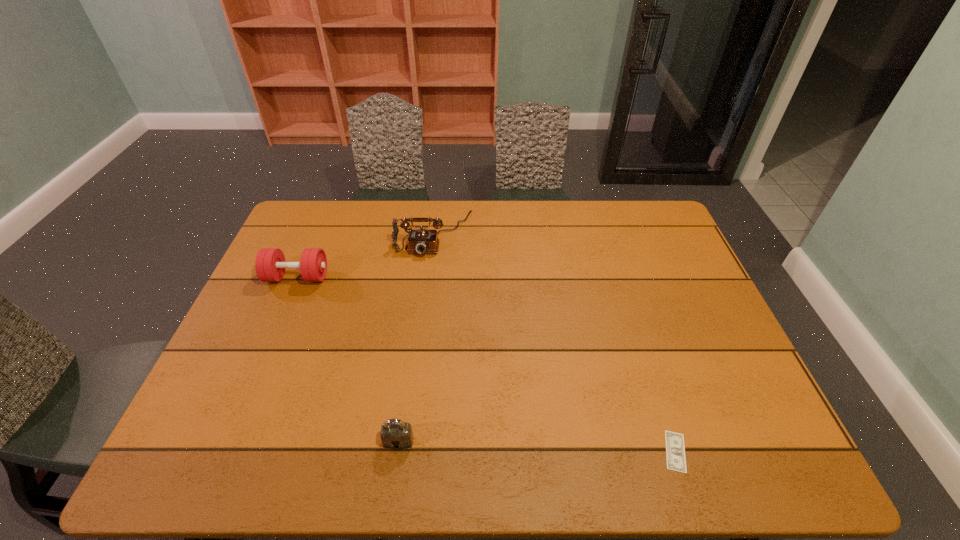
At what (x,y) coordinates should I click in order to perform the action: click on the closest object to the dumbbell. Please return your answer as a coordinate pair (x, y). This screenshot has width=960, height=540. Looking at the image, I should click on (421, 241).

Identify which object is located as the nearest to the padlock. Please provide its 2D coordinates. Your answer should be formatted as a tuple, i.e. [(x, y)], where the tuple contains the x and y coordinates of a point satisfying the conditions above.

[(270, 265)]

At what (x,y) coordinates should I click in order to perform the action: click on free space in the image that satisfies the following two spatial constraints: 1. on the dial of the telephone; 2. on the left side of the shortest object. Please return your answer as a coordinate pair (x, y). The width and height of the screenshot is (960, 540). Looking at the image, I should click on (407, 451).

Find the location of `free location that satisfies the following two spatial constraints: 1. on the front side of the rightmost object; 2. on the right side of the dumbbell`. free location that satisfies the following two spatial constraints: 1. on the front side of the rightmost object; 2. on the right side of the dumbbell is located at coordinates (223, 451).

In order to click on free space that satisfies the following two spatial constraints: 1. at the front of the shortest object near the keyhole; 2. on the right side of the padlock in this screenshot , I will do `click(397, 451)`.

Where is `blank area in the image that satisfies the following two spatial constraints: 1. at the front of the padlock near the keyhole; 2. on the right side of the rightmost object`? blank area in the image that satisfies the following two spatial constraints: 1. at the front of the padlock near the keyhole; 2. on the right side of the rightmost object is located at coordinates (397, 451).